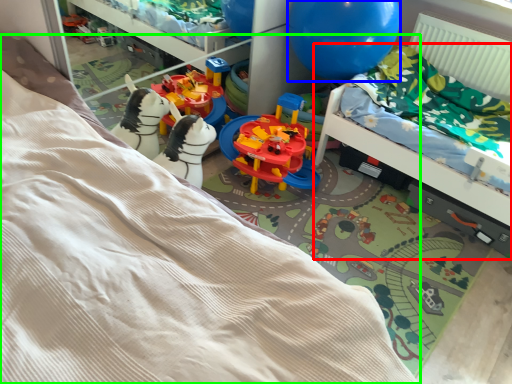
Question: Which is nearer to the hospital bed (highlighted by a red box)? balloon (highlighted by a blue box) or bed (highlighted by a green box).

Choices:
 (A) balloon
 (B) bed

Answer: (A)